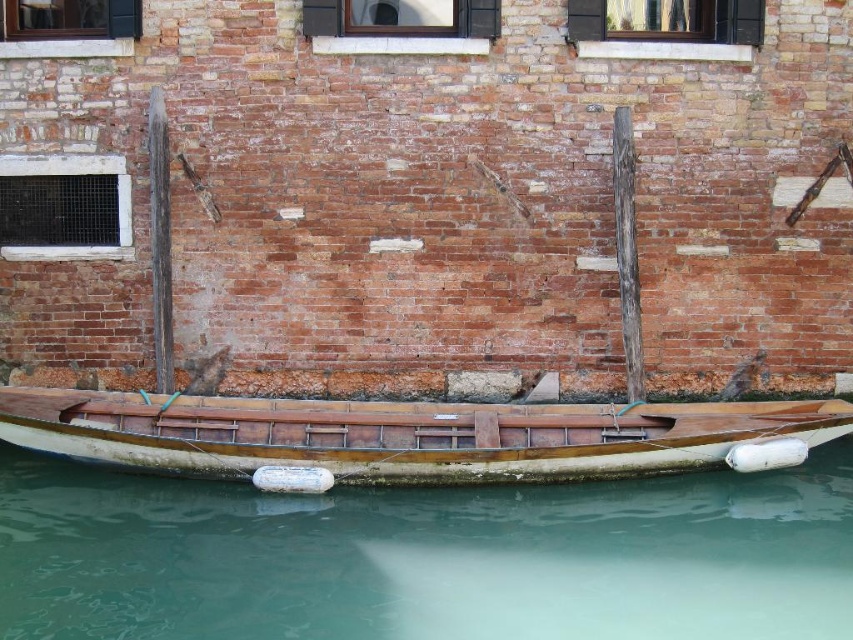
Question: Considering the relative positions of clear water at lower center and wooden boat at lower center in the image provided, where is clear water at lower center located with respect to wooden boat at lower center?

Choices:
 (A) below
 (B) above

Answer: (A)

Question: Is clear water at lower center thinner than wooden boat at lower center?

Choices:
 (A) no
 (B) yes

Answer: (A)

Question: In this image, where is clear water at lower center located relative to wooden boat at lower center?

Choices:
 (A) right
 (B) left

Answer: (A)